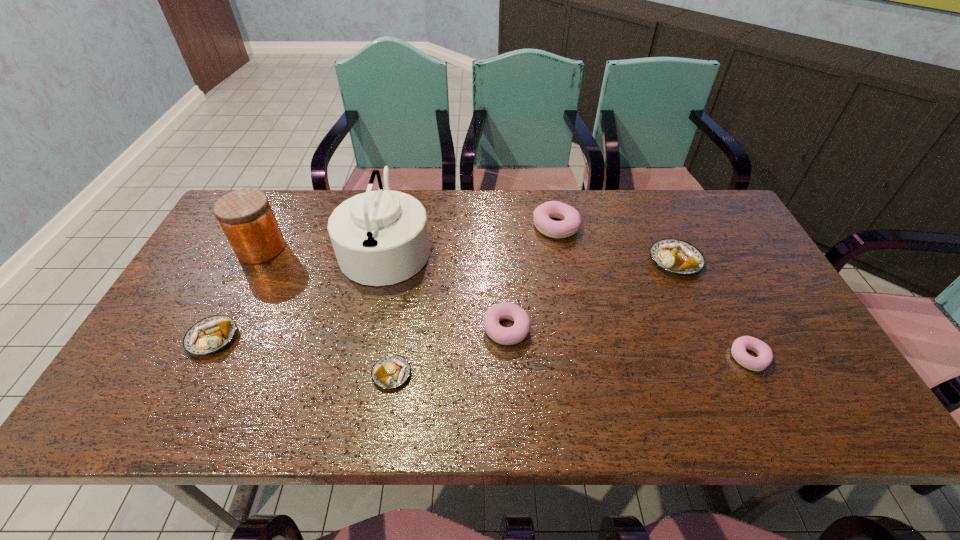
Identify the location of vacant space located on the back of the second biggest brown pastry. (274, 220).

Where is `blank space located 0.050m on the back of the smallest pink pastry`? The height and width of the screenshot is (540, 960). blank space located 0.050m on the back of the smallest pink pastry is located at coordinates (733, 325).

This screenshot has height=540, width=960. What are the coordinates of `vacant space located 0.050m on the left of the smallest brown pastry` in the screenshot? It's located at [x=350, y=374].

Identify the location of kettle that is positioned at the far edge. The height and width of the screenshot is (540, 960). (380, 237).

At what (x,y) coordinates should I click in order to perform the action: click on jar present at the far edge. Please return your answer as a coordinate pair (x, y). This screenshot has width=960, height=540. Looking at the image, I should click on (246, 217).

Locate an element on the screen. pastry positioned at the far edge is located at coordinates (571, 220).

Locate an element on the screen. Image resolution: width=960 pixels, height=540 pixels. object located at the near edge is located at coordinates (392, 371).

Find the location of a particular element. This screenshot has width=960, height=540. jar at the left edge is located at coordinates (246, 217).

At what (x,y) coordinates should I click in order to perform the action: click on pastry at the left edge. Please return your answer as a coordinate pair (x, y). This screenshot has width=960, height=540. Looking at the image, I should click on (209, 335).

In order to click on object positioned at the right edge in this screenshot , I will do `click(765, 355)`.